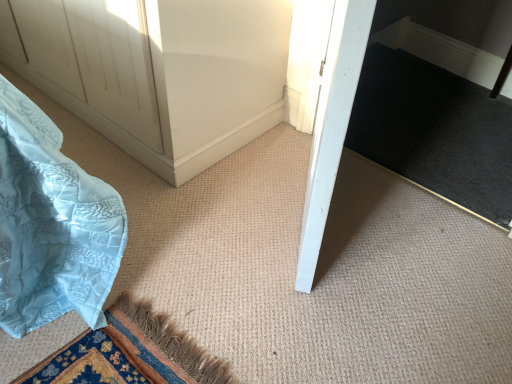
Where is `vacant space to the right of white smooth door at center`? The image size is (512, 384). vacant space to the right of white smooth door at center is located at coordinates (399, 228).